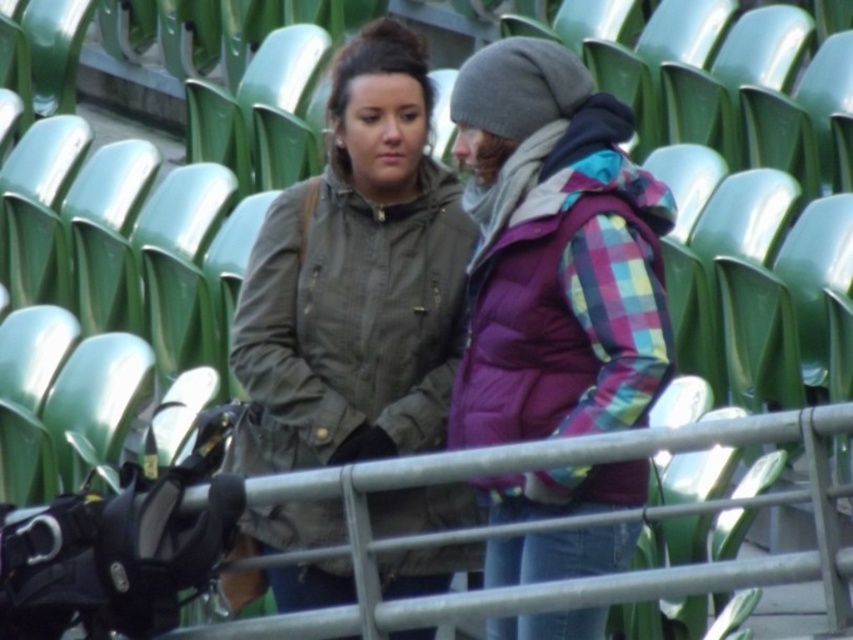
You are trying to take a photo of both the matte olive green jacket at center and the plaid puffer jacket at center from your current position. Which jacket will appear larger in the photo?

The matte olive green jacket at center will appear larger in the photo because it is closer to you than the plaid puffer jacket at center.

You are standing at the center of the stadium and see two points marked in the image. Which point is closer to you, point (427, 342) or point (500, 442)?

Point (427, 342) is closer to you because it is further to the viewer than point (500, 442).

You are standing in a stadium and see the matte olive green jacket at center. Can you tell me the exact coordinates where it is located?

The matte olive green jacket at center is located at point (357, 280).